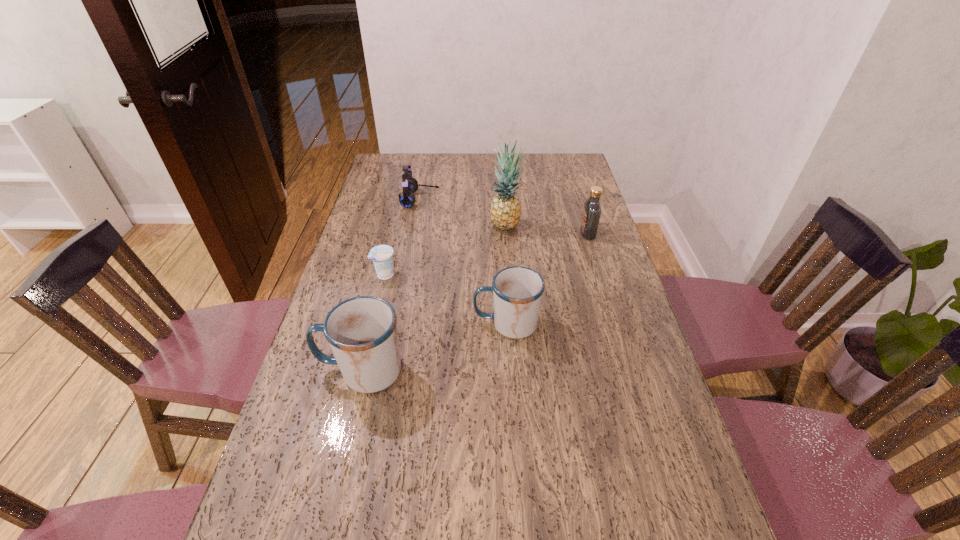
Find the location of a particular element. The width and height of the screenshot is (960, 540). free region located on the handle side of the farther mug is located at coordinates (378, 324).

Where is `vacant space located 0.180m on the handle side of the farther mug`? The image size is (960, 540). vacant space located 0.180m on the handle side of the farther mug is located at coordinates (410, 324).

Locate an element on the screen. This screenshot has height=540, width=960. free space located on the ear cushions of the farthest object is located at coordinates click(x=459, y=199).

Where is `vacant area located on the left of the pineapple`? Image resolution: width=960 pixels, height=540 pixels. vacant area located on the left of the pineapple is located at coordinates (388, 225).

Locate an element on the screen. The image size is (960, 540). vacant area situated 0.270m on the front-facing side of the rightmost object is located at coordinates (504, 234).

The width and height of the screenshot is (960, 540). I want to click on vacant area situated on the front-facing side of the rightmost object, so click(552, 234).

In order to click on vacant point located on the front-facing side of the rightmost object in this screenshot , I will do `click(510, 234)`.

Find the location of a particular element. The image size is (960, 540). vacant space located on the right of the yogurt is located at coordinates (457, 274).

Where is `mug that is at the left edge`? mug that is at the left edge is located at coordinates (362, 333).

The image size is (960, 540). I want to click on headset positioned at the left edge, so click(x=410, y=185).